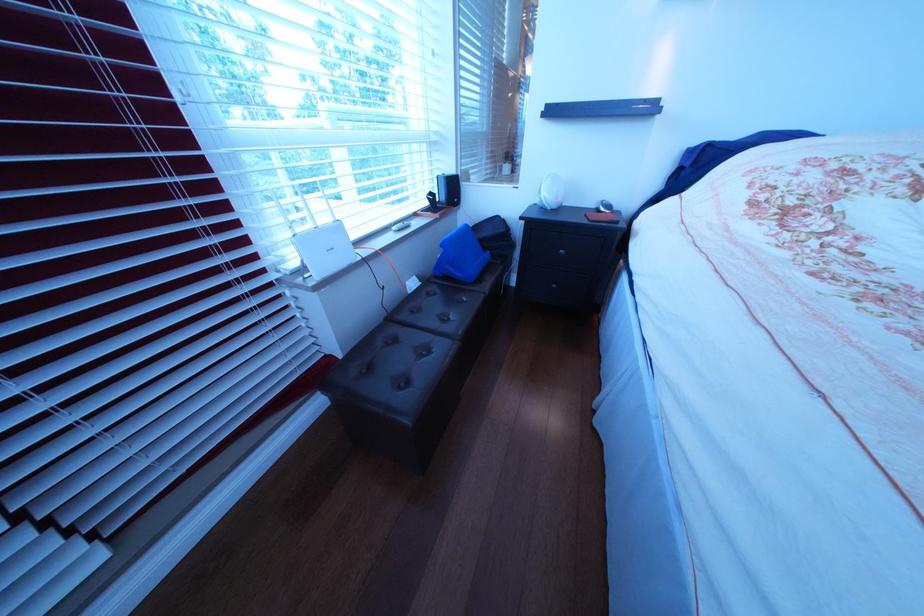
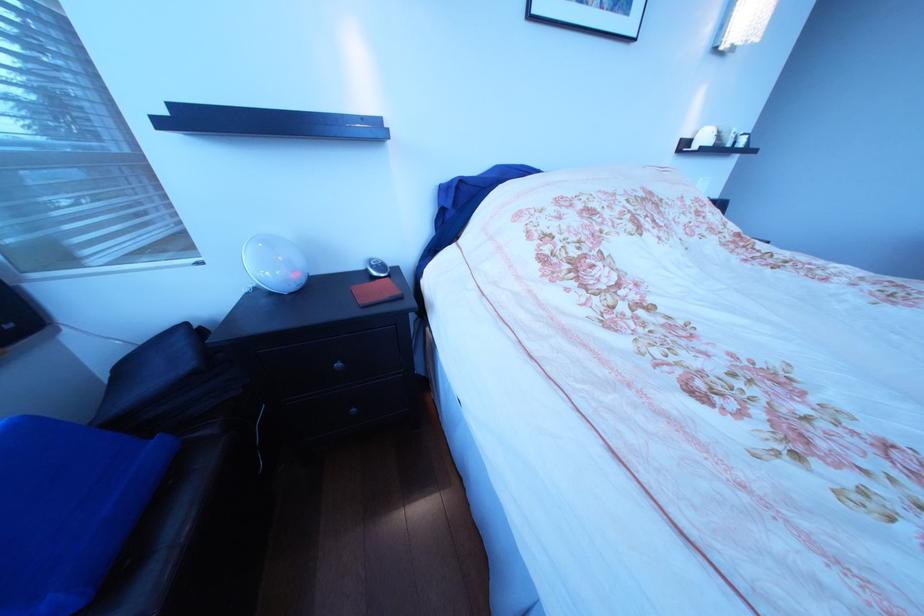
Question: The camera is either moving clockwise (left) or counter-clockwise (right) around the object. The first image is from the beginning of the video and the second image is from the end. Is the camera moving left or right when shooting the video?

Choices:
 (A) Left
 (B) Right

Answer: (A)